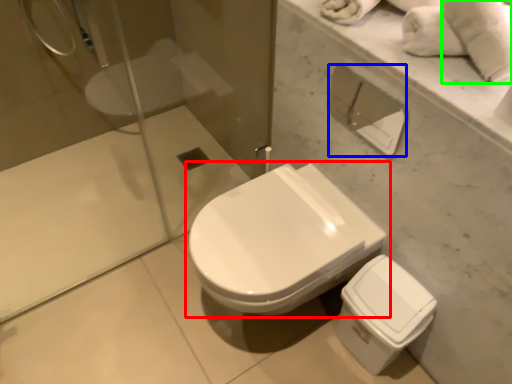
Question: Considering the real-world distances, which object is farthest from toilet (highlighted by a red box)? toilet paper (highlighted by a blue box) or bath towel (highlighted by a green box)?

Choices:
 (A) toilet paper
 (B) bath towel

Answer: (A)